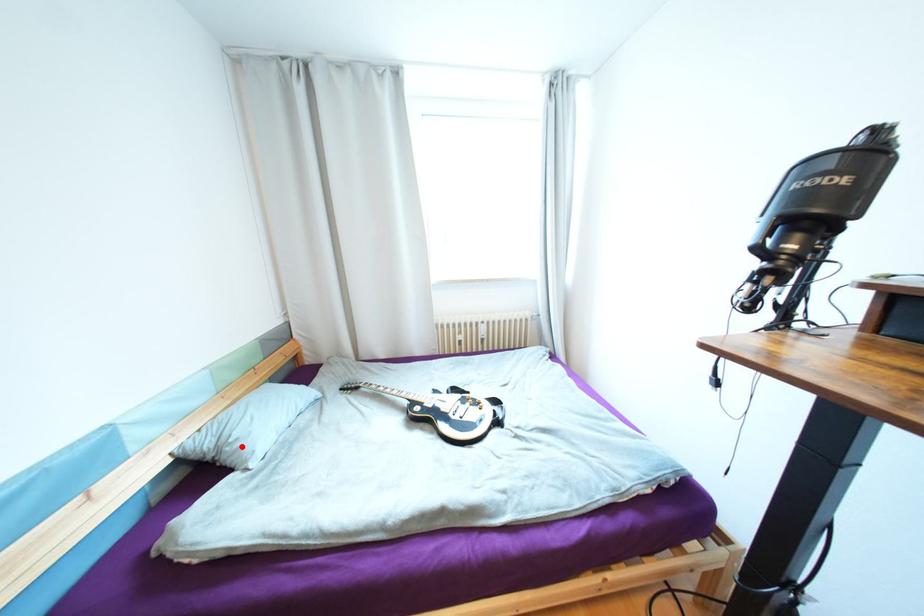
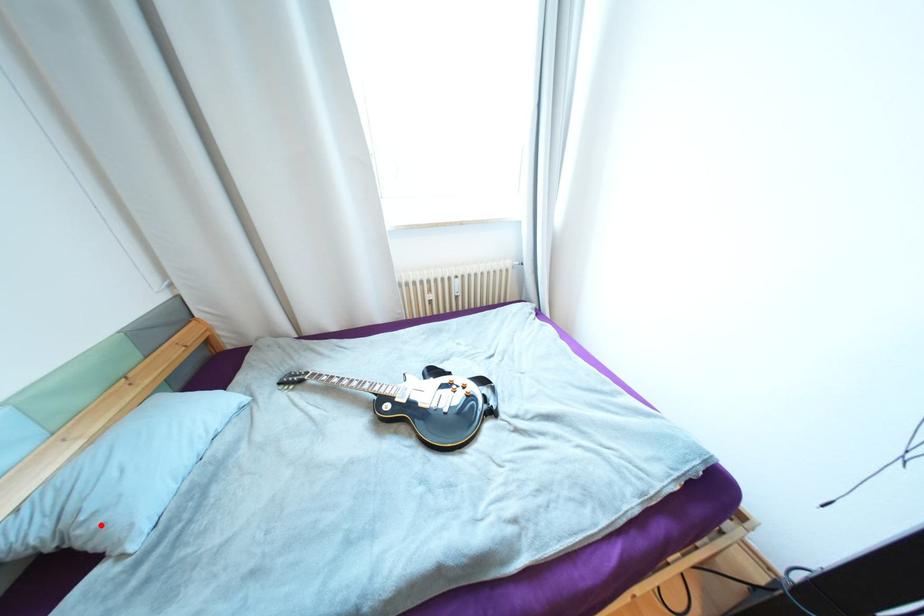
I am providing you with two images of the same scene from different viewpoints. A red point is marked on the first image and another point is marked on the second image. Does the point marked in image1 correspond to the same location as the one in image2?

Yes